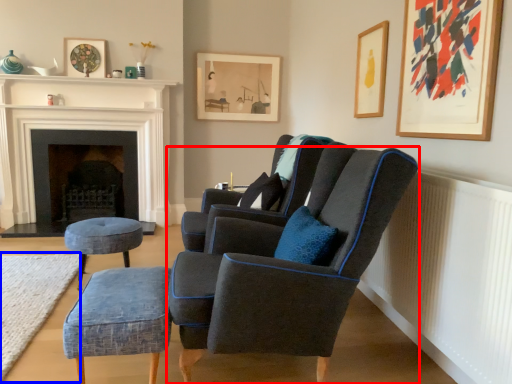
Question: Among these objects, which one is nearest to the camera, chair (highlighted by a red box) or plain (highlighted by a blue box)?

Choices:
 (A) chair
 (B) plain

Answer: (A)